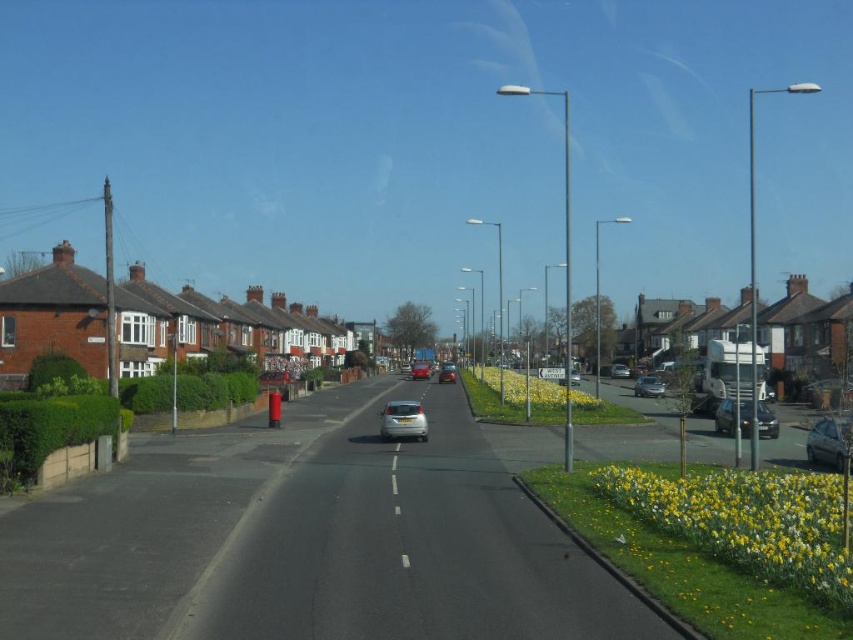
Can you confirm if satin silver sedan at center is taller than silver metallic sedan at center?

Incorrect, satin silver sedan at center's height is not larger of silver metallic sedan at center's.

Based on the photo, is satin silver sedan at center positioned behind silver metallic sedan at center?

Yes, satin silver sedan at center is further from the viewer.

Which is in front, point (642, 385) or point (560, 378)?

Point (642, 385) is in front.

Find the location of a particular element. satin silver sedan at center is located at coordinates (648, 387).

Who is higher up, satin black sedan at right or satin silver car at center?

satin black sedan at right

Is satin black sedan at right smaller than satin silver car at center?

No, satin black sedan at right is not smaller than satin silver car at center.

Between point (750, 416) and point (450, 380), which one is positioned behind?

Positioned behind is point (450, 380).

In order to click on satin black sedan at right in this screenshot , I will do `click(724, 417)`.

Does metallic silver car at center appear over matte silver car at center?

Actually, metallic silver car at center is below matte silver car at center.

The width and height of the screenshot is (853, 640). Describe the element at coordinates (421, 371) in the screenshot. I see `metallic silver car at center` at that location.

Image resolution: width=853 pixels, height=640 pixels. I want to click on metallic silver car at center, so click(421, 371).